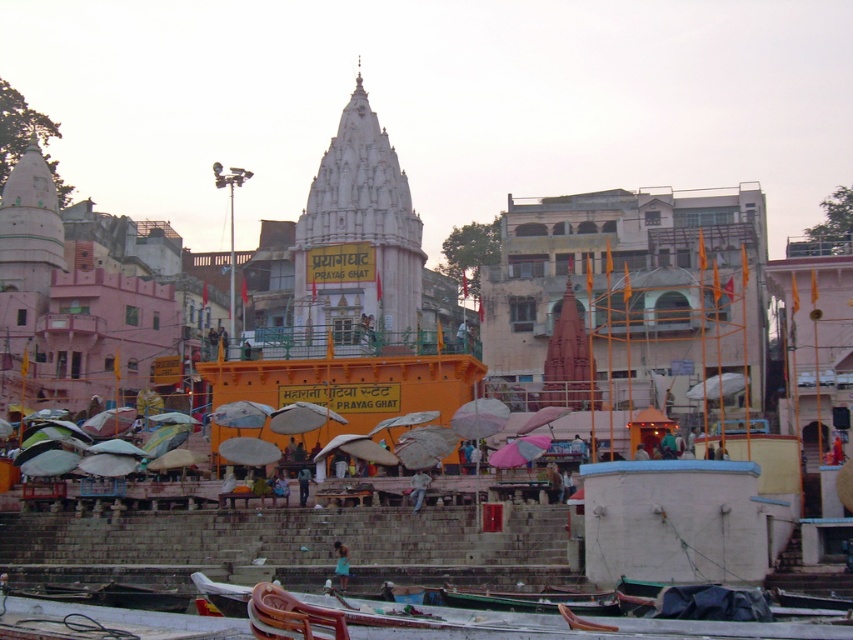
Between point (483, 600) and point (714, 397), which one is positioned in front?

Positioned in front is point (483, 600).

Is wooden boat at lower center to the right of white fabric umbrella at center from the viewer's perspective?

In fact, wooden boat at lower center is to the left of white fabric umbrella at center.

Which is in front, point (589, 596) or point (724, 390)?

Point (589, 596) is in front.

Locate an element on the screen. wooden boat at lower center is located at coordinates (532, 600).

Can you confirm if orange painted temple at center is positioned below white marble temple at center?

Indeed, orange painted temple at center is positioned under white marble temple at center.

What do you see at coordinates (627, 288) in the screenshot?
I see `orange painted temple at center` at bounding box center [627, 288].

Measure the distance between orange painted temple at center and camera.

A distance of 318.64 feet exists between orange painted temple at center and camera.

This screenshot has width=853, height=640. What are the coordinates of `orange painted temple at center` in the screenshot? It's located at (627, 288).

Is white fabric umbrella at center below blue fabric person at lower center?

No.

Is white fabric umbrella at center taller than blue fabric person at lower center?

Yes, white fabric umbrella at center is taller than blue fabric person at lower center.

Image resolution: width=853 pixels, height=640 pixels. Find the location of `white fabric umbrella at center`. white fabric umbrella at center is located at coordinates (717, 387).